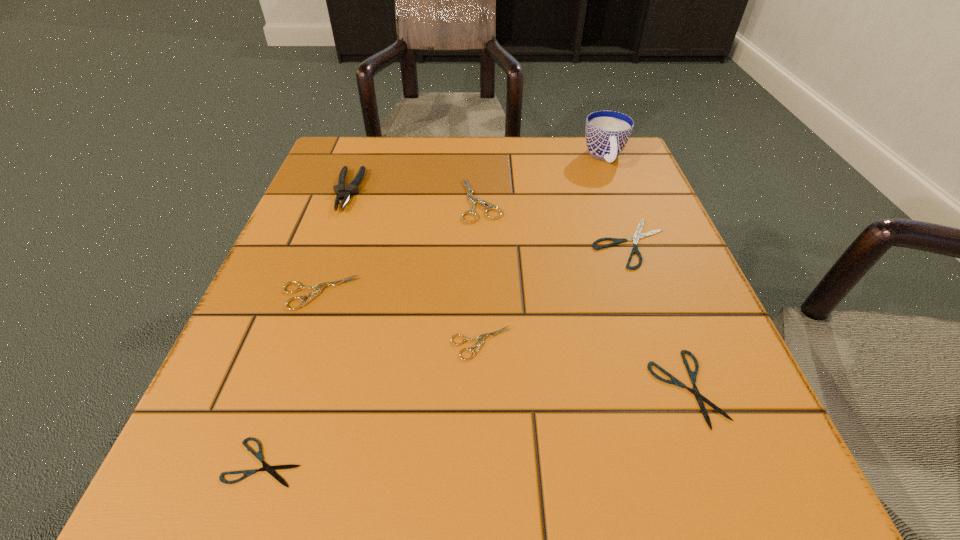
This screenshot has width=960, height=540. In order to click on free spot between the smallest beige shears and the pliers in this screenshot , I will do `click(415, 267)`.

You are a GUI agent. You are given a task and a screenshot of the screen. Output one action in this format:
    pyautogui.click(x=<x>, y=<y>)
    Task: Click on the free area in between the biggest beige shears and the leftmost black shears
    This screenshot has width=960, height=540.
    Given the screenshot: What is the action you would take?
    click(x=372, y=332)

At what (x,y) coordinates should I click in order to perform the action: click on unoccupied area between the blue cup and the second farthest black shears. Please return your answer as a coordinate pair (x, y). This screenshot has width=960, height=540. Looking at the image, I should click on (645, 273).

Find the location of `vacant space that is in between the shortest object and the second smallest black shears`. vacant space that is in between the shortest object and the second smallest black shears is located at coordinates (475, 425).

Locate an element on the screen. This screenshot has height=540, width=960. free space between the nearest black shears and the smallest beige shears is located at coordinates click(372, 403).

Where is `free space between the farthest beige shears and the pliers`? This screenshot has width=960, height=540. free space between the farthest beige shears and the pliers is located at coordinates (415, 195).

This screenshot has height=540, width=960. Identify the location of object identified as the seventh closest to the blue cup. (270, 469).

Choose which object is the third nearest neighbor to the nearest black shears. Please provide its 2D coordinates. Your answer should be formatted as a tuple, i.e. [(x, y)], where the tuple contains the x and y coordinates of a point satisfying the conditions above.

[(692, 375)]

Locate which shears ranks fourth in proximity to the farthest black shears. Please provide its 2D coordinates. Your answer should be formatted as a tuple, i.e. [(x, y)], where the tuple contains the x and y coordinates of a point satisfying the conditions above.

[(318, 288)]

The height and width of the screenshot is (540, 960). Identify the location of shears that can be found as the second closest to the nearest black shears. (318, 288).